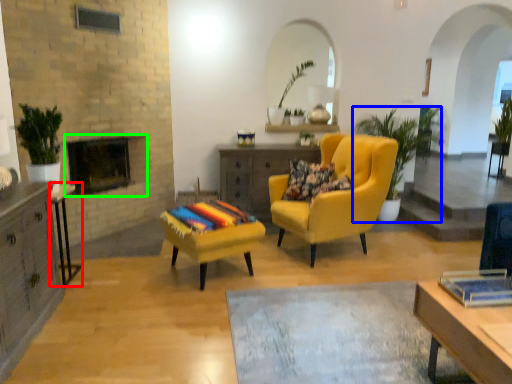
Question: Based on their relative distances, which object is farther from table (highlighted by a red box)? Choose from houseplant (highlighted by a blue box) and fireplace (highlighted by a green box).

Choices:
 (A) houseplant
 (B) fireplace

Answer: (A)